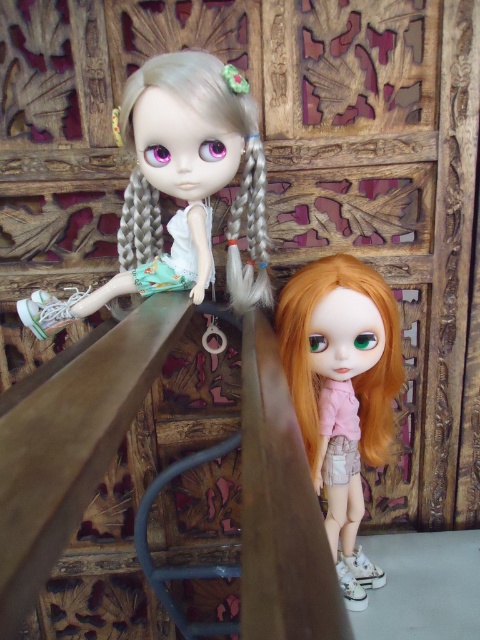
Question: Which is farther from the matte white doll at upper left?

Choices:
 (A) matte pink shirt at center
 (B) satin silver pigtail at upper left

Answer: (A)

Question: Does matte white doll at upper left appear over matte pink shirt at center?

Choices:
 (A) no
 (B) yes

Answer: (B)

Question: Is matte white doll at upper left to the right of satin silver pigtail at upper left from the viewer's perspective?

Choices:
 (A) yes
 (B) no

Answer: (B)

Question: Which object appears closest to the camera in this image?

Choices:
 (A) matte white doll at upper left
 (B) satin silver pigtail at upper left
 (C) matte pink shirt at center

Answer: (A)

Question: Can you confirm if matte white doll at upper left is smaller than satin silver pigtail at upper left?

Choices:
 (A) no
 (B) yes

Answer: (A)

Question: Which is nearer to the matte white doll at upper left?

Choices:
 (A) satin silver pigtail at upper left
 (B) matte pink shirt at center

Answer: (A)